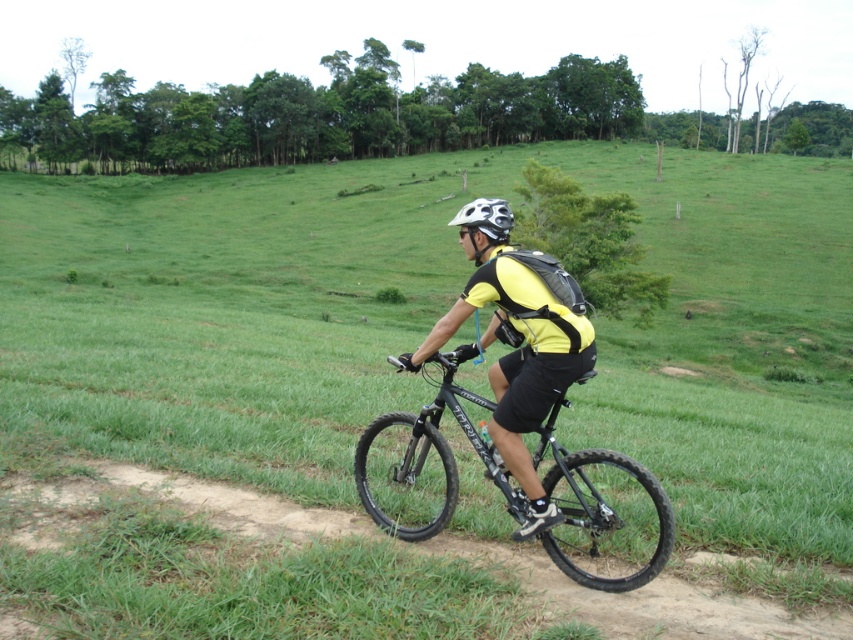
Can you confirm if black matte bicycle at center is wider than matte black bicycle at center?

Yes.

Does black matte bicycle at center appear on the right side of matte black bicycle at center?

Yes, black matte bicycle at center is to the right of matte black bicycle at center.

Between point (399, 525) and point (544, 516), which one is positioned in front?

Point (544, 516) is more forward.

Find the location of a particular element. Image resolution: width=853 pixels, height=640 pixels. black matte bicycle at center is located at coordinates (604, 515).